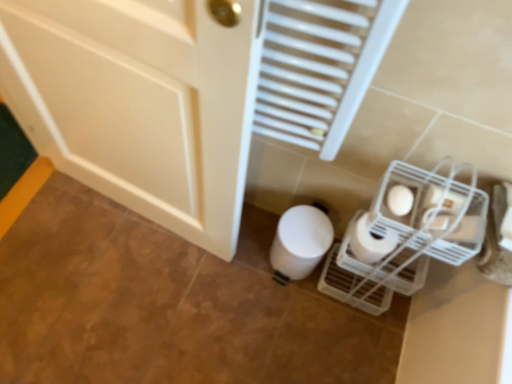
Question: Could you tell me if white matte toilet paper at lower center, the third toilet paper from the front, is turned towards white matte toilet paper at lower right, the third toilet paper positioned from the back?

Choices:
 (A) no
 (B) yes

Answer: (A)

Question: Considering the relative sizes of white matte toilet paper at lower center, the third toilet paper from the front, and white matte toilet paper at lower right, the third toilet paper positioned from the back, in the image provided, is white matte toilet paper at lower center, the third toilet paper from the front, wider than white matte toilet paper at lower right, the third toilet paper positioned from the back,?

Choices:
 (A) yes
 (B) no

Answer: (A)

Question: Is the surface of white matte toilet paper at lower center, the first toilet paper from the back, in direct contact with white matte toilet paper at lower right, the first toilet paper in the front-to-back sequence?

Choices:
 (A) no
 (B) yes

Answer: (A)

Question: Is white matte toilet paper at lower center, the first toilet paper from the back, facing away from white matte toilet paper at lower right, the third toilet paper positioned from the back?

Choices:
 (A) no
 (B) yes

Answer: (A)

Question: Is white matte toilet paper at lower center, the first toilet paper from the back, bigger than white matte toilet paper at lower right, the third toilet paper positioned from the back?

Choices:
 (A) yes
 (B) no

Answer: (A)

Question: Is white matte toilet paper at lower center, the first toilet paper from the back, taller or shorter than white matte toilet paper at lower right, the third toilet paper positioned from the back?

Choices:
 (A) short
 (B) tall

Answer: (B)

Question: Would you say white matte toilet paper at lower center, the first toilet paper from the back, is to the left or to the right of white matte toilet paper at lower right, the first toilet paper in the front-to-back sequence, in the picture?

Choices:
 (A) left
 (B) right

Answer: (A)

Question: Is white matte toilet paper at lower center, the third toilet paper from the front, spatially inside white matte toilet paper at lower right, the first toilet paper in the front-to-back sequence, or outside of it?

Choices:
 (A) outside
 (B) inside

Answer: (A)

Question: Considering the positions of white matte toilet paper at lower center, the first toilet paper from the back, and white matte toilet paper at lower right, the third toilet paper positioned from the back, in the image, is white matte toilet paper at lower center, the first toilet paper from the back, bigger or smaller than white matte toilet paper at lower right, the third toilet paper positioned from the back,?

Choices:
 (A) small
 (B) big

Answer: (B)

Question: Based on their sizes in the image, would you say white matte toilet paper at lower right, which is the 2th toilet paper in front-to-back order, is bigger or smaller than white matte toilet paper at lower center, the third toilet paper from the front?

Choices:
 (A) small
 (B) big

Answer: (A)

Question: From the image's perspective, is white matte toilet paper at lower right, which appears as the second toilet paper when viewed from the back, positioned above or below white matte toilet paper at lower center, the third toilet paper from the front?

Choices:
 (A) above
 (B) below

Answer: (A)

Question: Is point (373, 244) closer or farther from the camera than point (285, 276)?

Choices:
 (A) farther
 (B) closer

Answer: (B)

Question: Considering the positions of white matte toilet paper at lower right, which appears as the second toilet paper when viewed from the back, and white matte toilet paper at lower center, the first toilet paper from the back, in the image, is white matte toilet paper at lower right, which appears as the second toilet paper when viewed from the back, taller or shorter than white matte toilet paper at lower center, the first toilet paper from the back,?

Choices:
 (A) tall
 (B) short

Answer: (B)

Question: From the image's perspective, is white plastic radiator at upper center above or below white matte toilet paper at lower center, the third toilet paper from the front?

Choices:
 (A) below
 (B) above

Answer: (B)

Question: Is white plastic radiator at upper center situated inside white matte toilet paper at lower center, the third toilet paper from the front, or outside?

Choices:
 (A) inside
 (B) outside

Answer: (B)